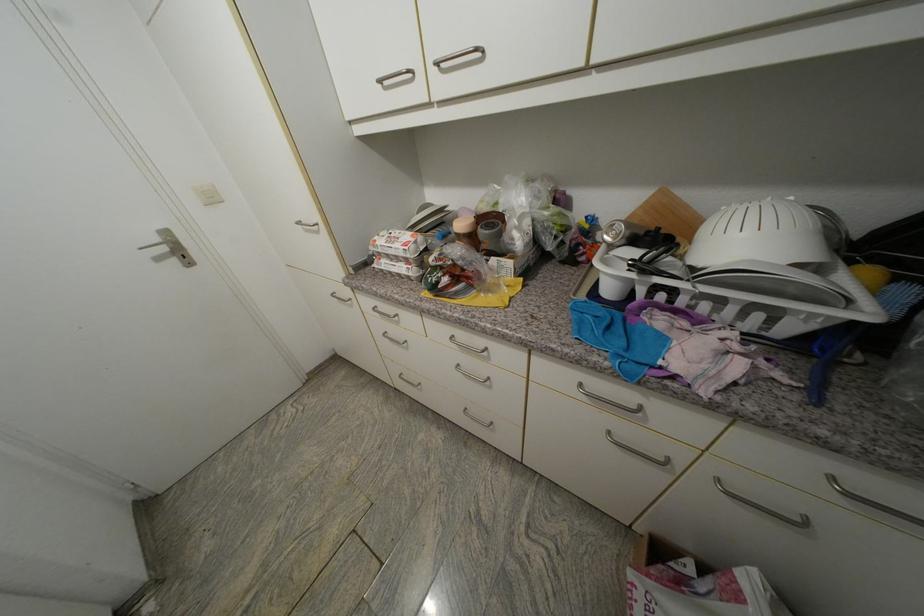
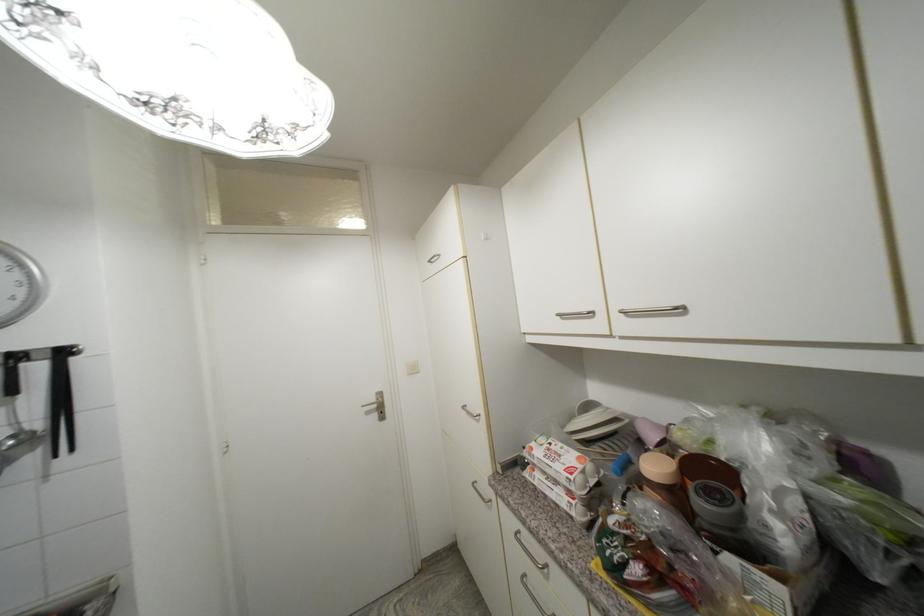
The first image is from the beginning of the video and the second image is from the end. How did the camera likely rotate when shooting the video?

The camera rotated toward left-up.